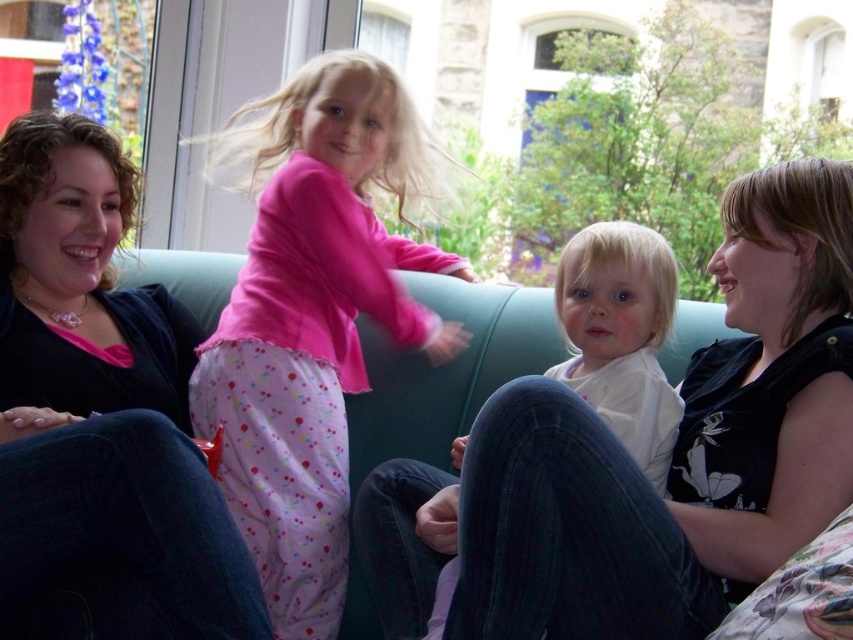
Is pink cotton pajamas at center closer to camera compared to white soft fabric at center?

That is False.

Which is in front, point (292, 189) or point (596, 326)?

Point (596, 326)

You are a GUI agent. You are given a task and a screenshot of the screen. Output one action in this format:
    pyautogui.click(x=<x>, y=<y>)
    Task: Click on the pink cotton pajamas at center
    The width and height of the screenshot is (853, 640).
    Given the screenshot: What is the action you would take?
    pyautogui.click(x=312, y=320)

Between pink cotton pajamas at center and white matte shirt at center, which one has more height?

With more height is pink cotton pajamas at center.

You are a GUI agent. You are given a task and a screenshot of the screen. Output one action in this format:
    pyautogui.click(x=<x>, y=<y>)
    Task: Click on the pink cotton pajamas at center
    
    Given the screenshot: What is the action you would take?
    pyautogui.click(x=312, y=320)

Is point (398, 310) positioned behind point (654, 358)?

Yes, point (398, 310) is behind point (654, 358).

Where is `pink cotton pajamas at center`? pink cotton pajamas at center is located at coordinates (312, 320).

Is point (250, 605) closer to viewer compared to point (665, 429)?

Yes.

Does point (245, 609) lie behind point (619, 248)?

No.

Is point (112, 179) positioned in front of point (619, 356)?

That is False.

The height and width of the screenshot is (640, 853). In order to click on matte black sweater at left in this screenshot , I will do `click(103, 394)`.